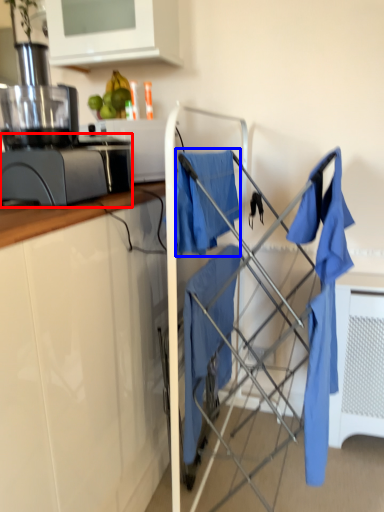
Question: Which object appears farthest to the camera in this image, kitchen appliance (highlighted by a red box) or clothe (highlighted by a blue box)?

Choices:
 (A) kitchen appliance
 (B) clothe

Answer: (A)